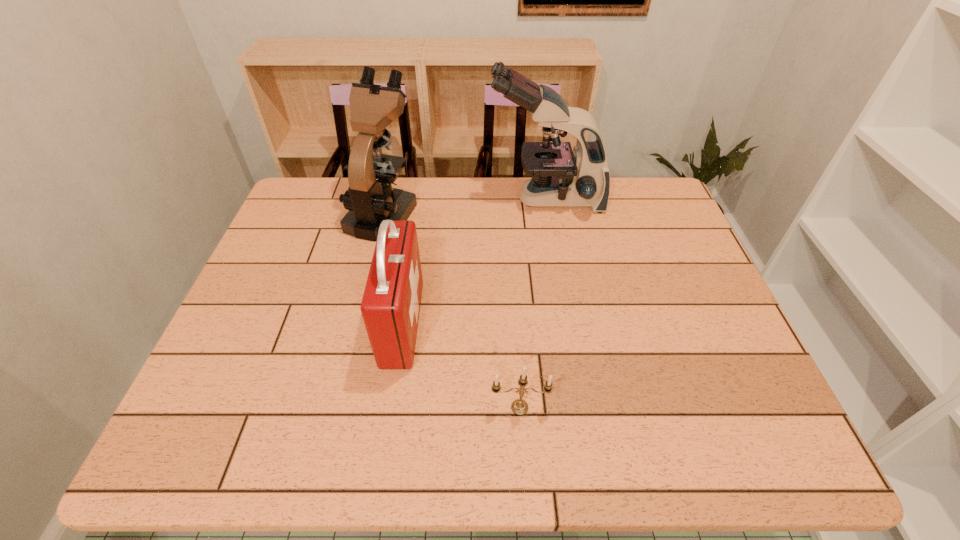
You are a GUI agent. You are given a task and a screenshot of the screen. Output one action in this format:
    pyautogui.click(x=<x>, y=<y>)
    Task: Click on the vacant region located on the front face of the third farthest object
    
    Given the screenshot: What is the action you would take?
    pyautogui.click(x=469, y=324)

Identify the location of vacant space positioned on the back of the nearest object. The width and height of the screenshot is (960, 540). (512, 282).

In order to click on vacant space at the far edge of the desktop in this screenshot , I will do `click(416, 221)`.

At what (x,y) coordinates should I click in order to perform the action: click on free space at the near edge. Please return your answer as a coordinate pair (x, y). The image size is (960, 540). Looking at the image, I should click on (668, 441).

Locate an element on the screen. The image size is (960, 540). vacant space at the left edge of the desktop is located at coordinates (212, 373).

In the image, there is a desktop. Where is `vacant space at the near right corner`? vacant space at the near right corner is located at coordinates (789, 453).

Where is `vacant area that lies between the first-aid kit and the shortest object`? The image size is (960, 540). vacant area that lies between the first-aid kit and the shortest object is located at coordinates (461, 366).

Locate an element on the screen. empty space between the right microscope and the second nearest object is located at coordinates (474, 262).

At what (x,y) coordinates should I click in order to perform the action: click on free area in between the right microscope and the third tallest object. Please return your answer as a coordinate pair (x, y). The width and height of the screenshot is (960, 540). Looking at the image, I should click on (474, 262).

What are the coordinates of `free point between the right microscope and the second nearest object` in the screenshot? It's located at (474, 262).